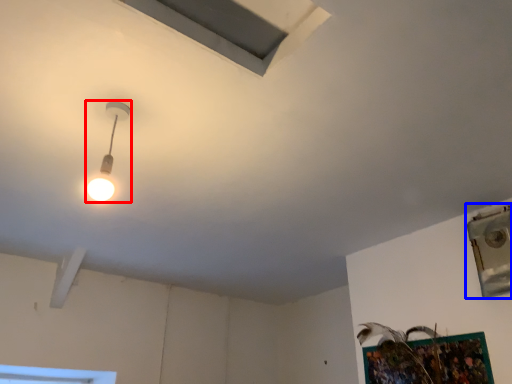
Question: Which object is further to the camera taking this photo, lamp (highlighted by a red box) or window (highlighted by a blue box)?

Choices:
 (A) lamp
 (B) window

Answer: (B)